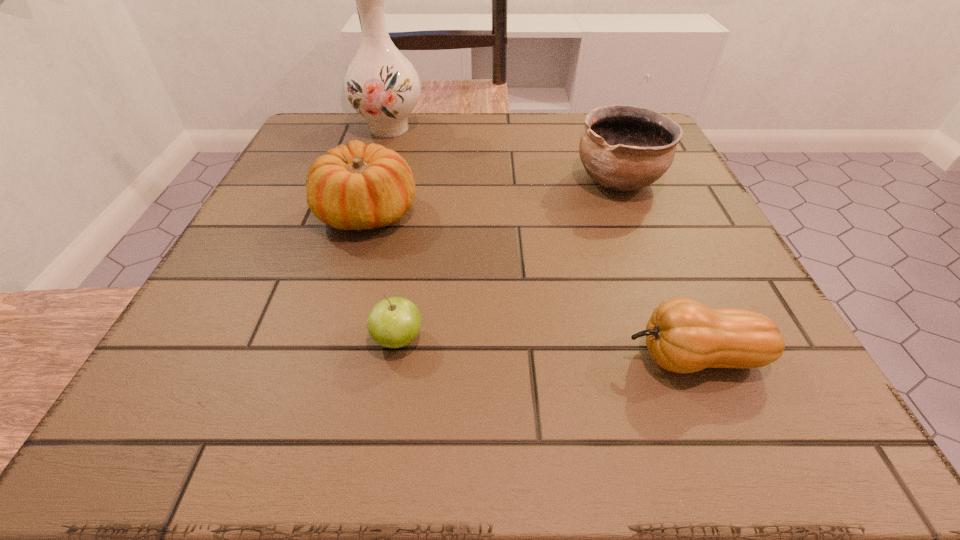
Identify the location of the tallest object. This screenshot has width=960, height=540. (381, 84).

Find the location of a particular element. vase is located at coordinates (381, 84).

Where is `pottery`? This screenshot has height=540, width=960. pottery is located at coordinates (623, 148).

I want to click on the left gourd, so click(359, 187).

Identify the location of the farther gourd. Image resolution: width=960 pixels, height=540 pixels. (359, 187).

Locate an element on the screen. The image size is (960, 540). the second shortest object is located at coordinates pos(682,335).

At what (x,y) coordinates should I click in order to perform the action: click on the right gourd. Please return your answer as a coordinate pair (x, y). This screenshot has width=960, height=540. Looking at the image, I should click on (682, 335).

Where is `the shortest object`? the shortest object is located at coordinates (394, 322).

Where is `vacant position located on the right of the vase`? The width and height of the screenshot is (960, 540). vacant position located on the right of the vase is located at coordinates (585, 129).

Locate an element on the screen. This screenshot has width=960, height=540. free region located 0.290m on the left of the pottery is located at coordinates (x=435, y=180).